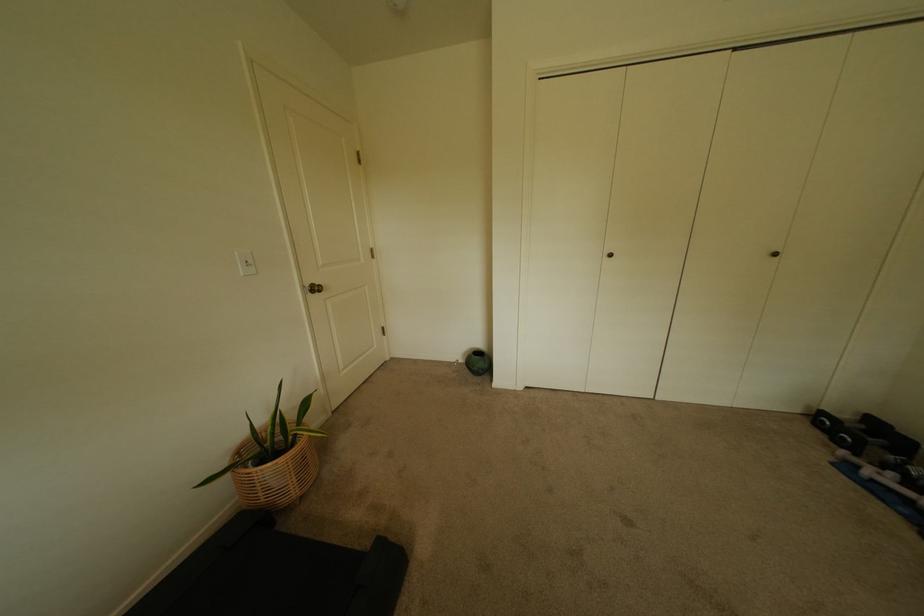
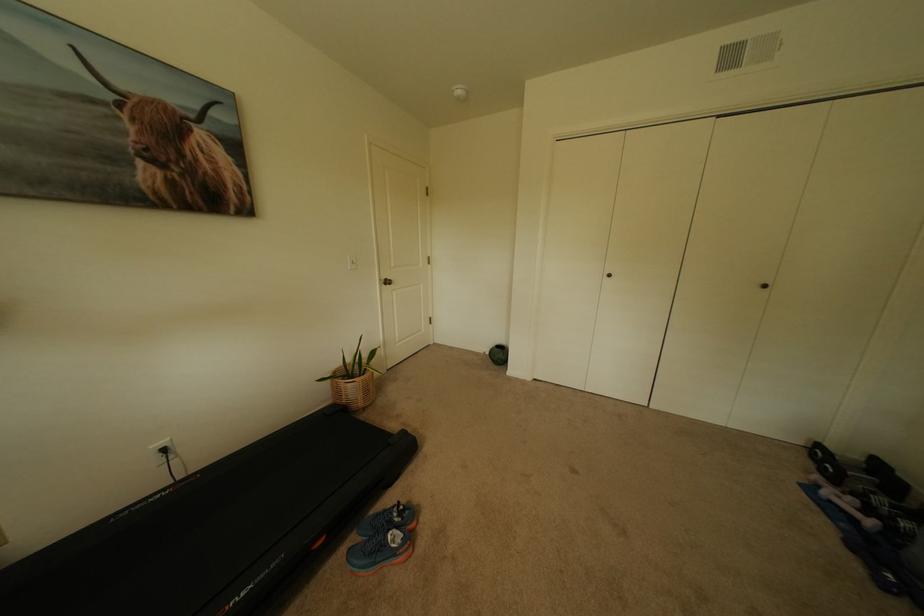
Where in the second image is the point corresponding to (315,286) from the first image?

(391, 280)